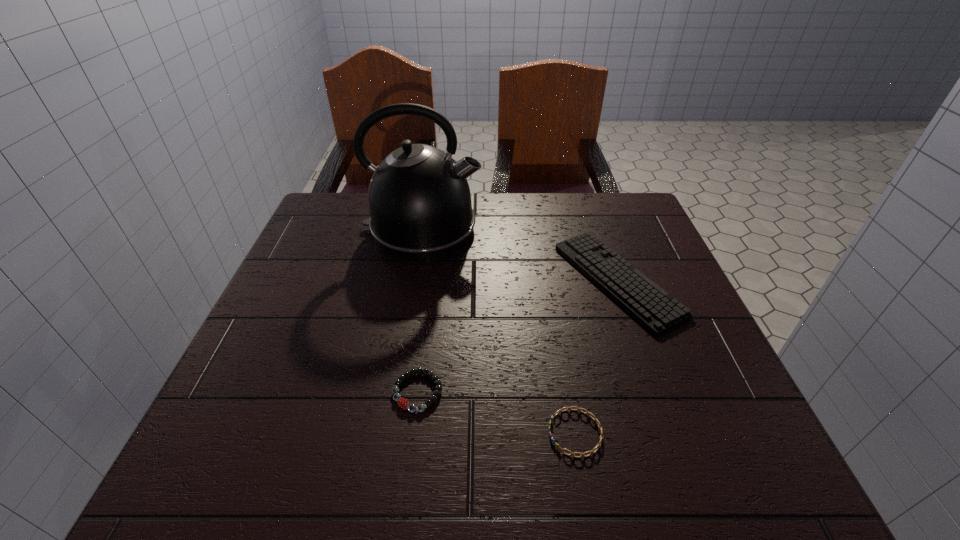
I want to click on free space that is in between the shortest object and the computer keyboard, so click(x=596, y=356).

The height and width of the screenshot is (540, 960). I want to click on empty space between the shortest object and the left bracelet, so click(496, 412).

At what (x,y) coordinates should I click in order to perform the action: click on vacant area that lies between the computer keyboard and the kettle. Please return your answer as a coordinate pair (x, y). Image resolution: width=960 pixels, height=540 pixels. Looking at the image, I should click on (520, 254).

The image size is (960, 540). In order to click on free space between the shortest object and the tallest object in this screenshot , I will do `click(499, 331)`.

Locate an element on the screen. This screenshot has height=540, width=960. free area in between the computer keyboard and the kettle is located at coordinates (520, 254).

You are a GUI agent. You are given a task and a screenshot of the screen. Output one action in this format:
    pyautogui.click(x=<x>, y=<y>)
    Task: Click on the free area in between the kettle and the taller bracelet
    This screenshot has width=960, height=540.
    Given the screenshot: What is the action you would take?
    pyautogui.click(x=420, y=310)

Find the location of a particular element. object that is the second closest to the shorter bracelet is located at coordinates (402, 402).

The image size is (960, 540). Identify the location of object that stands as the second closest to the third tallest object. (654, 308).

In order to click on free space that satisfies the following two spatial constraints: 1. on the spout of the tallest object; 2. on the left side of the computer keyboard in this screenshot , I will do `click(414, 280)`.

The image size is (960, 540). I want to click on vacant space that satisfies the following two spatial constraints: 1. on the spout of the kettle; 2. on the back side of the third shortest object, so click(x=414, y=280).